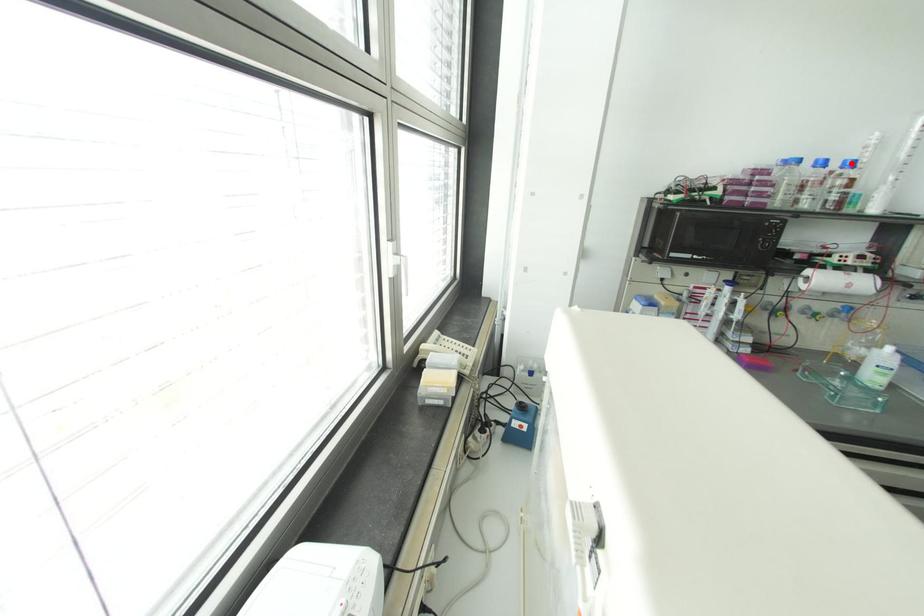
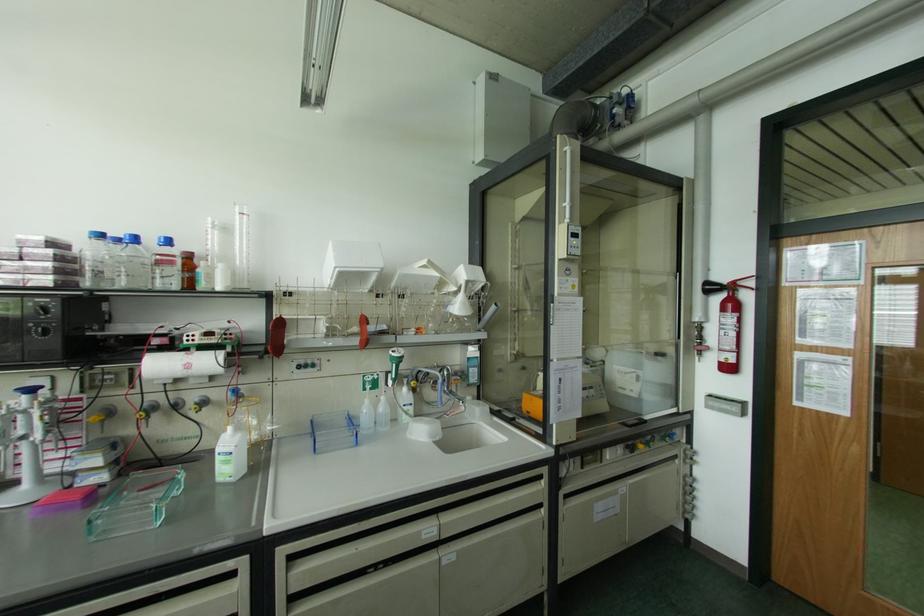
Locate, in the second image, the point that corresponds to the highlighted location in the first image.

(167, 241)